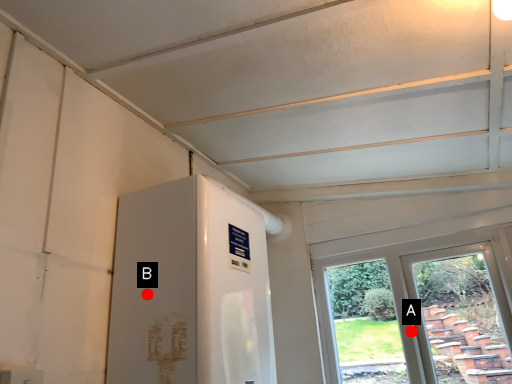
Question: Two points are circled on the image, labeled by A and B beside each circle. Which point is farther to the camera?

Choices:
 (A) A is further
 (B) B is further

Answer: (A)